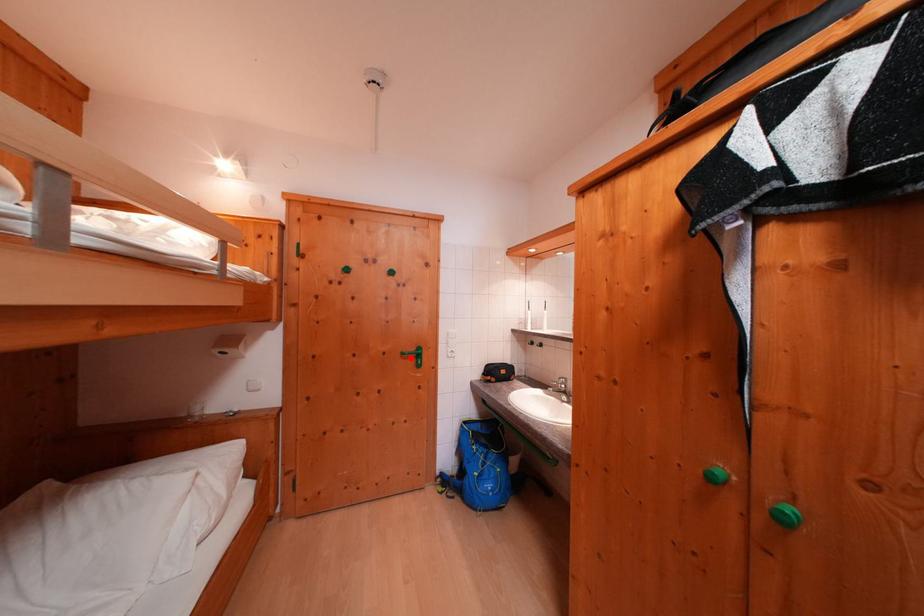
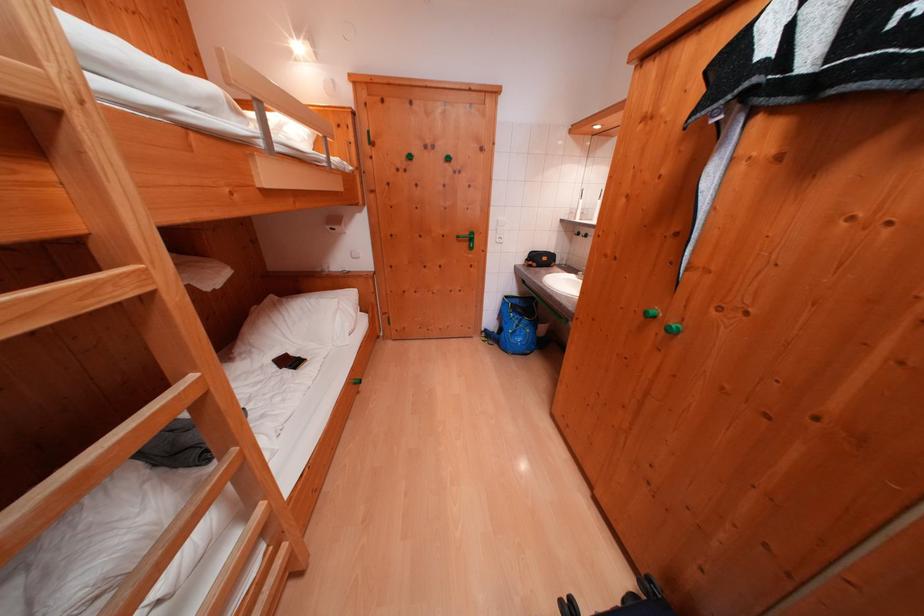
Question: I am providing you with two images of the same scene from different viewpoints. A red point is shown in image1. For the corresponding object point in image2, is it positioned nearer or farther from the camera?

Choices:
 (A) Nearer
 (B) Farther

Answer: (A)